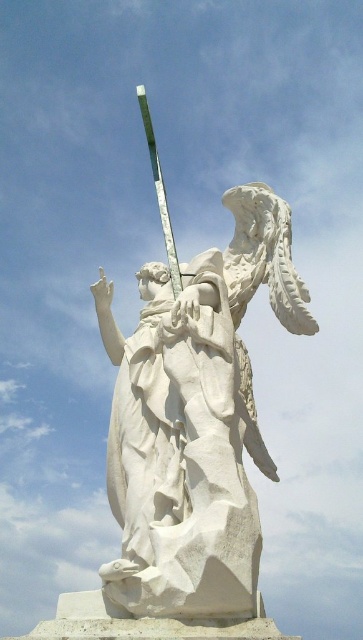
Question: Which point appears farthest from the camera in this image?

Choices:
 (A) (102, 310)
 (B) (152, 125)

Answer: (B)

Question: Can you confirm if white marble statue at center is thinner than green glass pole at upper center?

Choices:
 (A) no
 (B) yes

Answer: (A)

Question: Is white marble statue at center below green glass pole at upper center?

Choices:
 (A) no
 (B) yes

Answer: (B)

Question: Does white marble statue at center have a greater width compared to green glass pole at upper center?

Choices:
 (A) yes
 (B) no

Answer: (A)

Question: Which point is closer to the camera?

Choices:
 (A) white marble statue at center
 (B) green glass pole at upper center

Answer: (A)